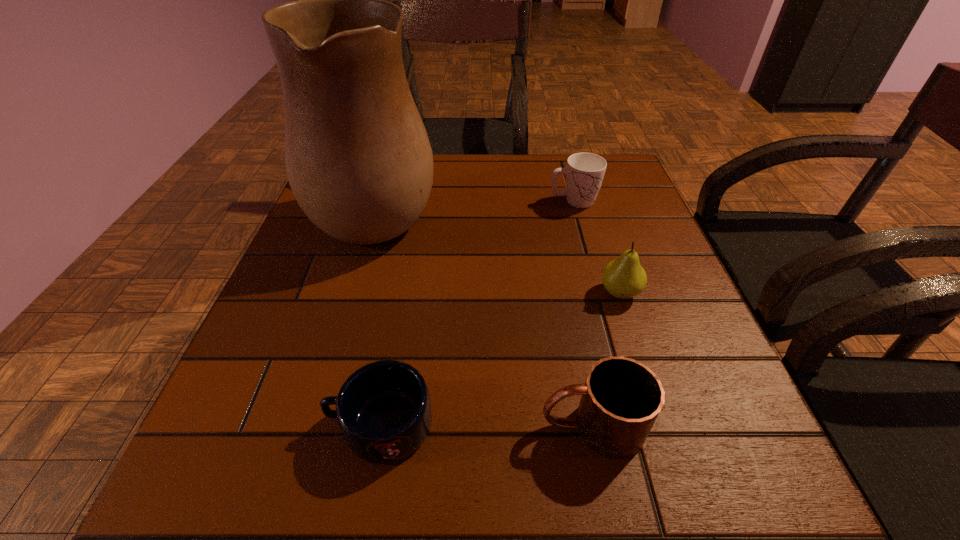
You are a GUI agent. You are given a task and a screenshot of the screen. Output one action in this format:
    pyautogui.click(x=<x>, y=<y>)
    Task: Click on the vacant position located with the handle on the side of the shortest mug
    The height and width of the screenshot is (540, 960).
    Given the screenshot: What is the action you would take?
    pyautogui.click(x=234, y=424)

Where is `cream pitcher that is at the far edge`? cream pitcher that is at the far edge is located at coordinates (358, 159).

You are a GUI agent. You are given a task and a screenshot of the screen. Output one action in this format:
    pyautogui.click(x=<x>, y=<y>)
    Task: Click on the mug that is at the far edge
    This screenshot has width=960, height=540.
    Given the screenshot: What is the action you would take?
    pyautogui.click(x=584, y=172)

The height and width of the screenshot is (540, 960). In order to click on object that is at the left edge in this screenshot , I will do `click(358, 159)`.

Image resolution: width=960 pixels, height=540 pixels. Identify the location of pear located at the right edge. (624, 278).

Identify the location of object that is positioned at the far left corner. The image size is (960, 540). (358, 159).

The image size is (960, 540). What are the coordinates of `object situated at the far right corner` in the screenshot? It's located at (584, 172).

Where is `object present at the near right corner`? This screenshot has height=540, width=960. object present at the near right corner is located at coordinates (621, 398).

Locate an element on the screen. The image size is (960, 540). vacant region at the far edge of the desktop is located at coordinates (548, 167).

The height and width of the screenshot is (540, 960). I want to click on free space at the near edge of the desktop, so click(453, 472).